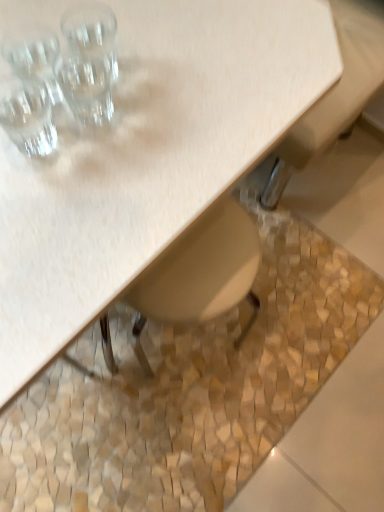
This screenshot has width=384, height=512. Find the location of `vacant space to the left of transparent glass at upper left, positioned as the 2th shot glass in bottom-to-top order`. vacant space to the left of transparent glass at upper left, positioned as the 2th shot glass in bottom-to-top order is located at coordinates (28, 84).